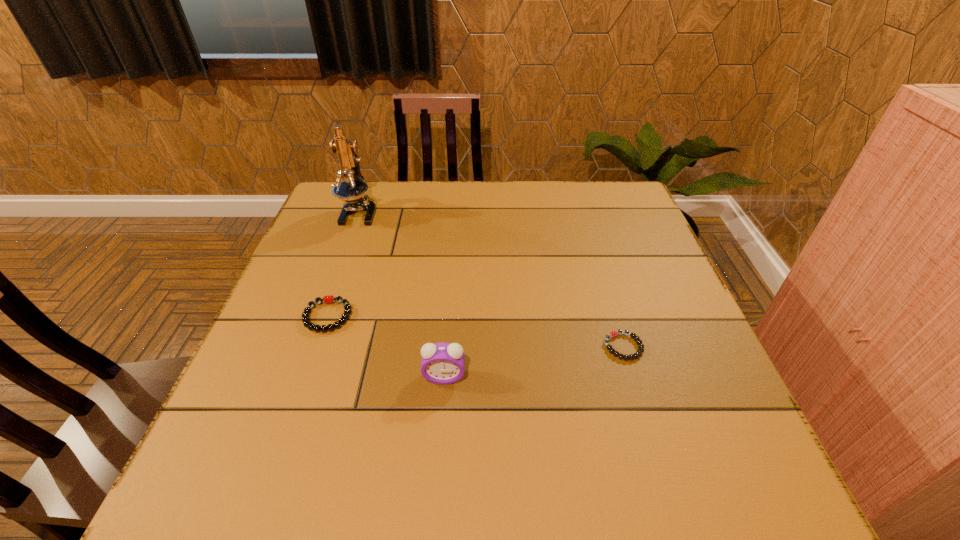
In order to click on empty location between the third tallest object and the shorter bracelet in this screenshot , I will do `click(475, 332)`.

I want to click on free space between the right bracelet and the nearest object, so click(534, 362).

Point out which object is positioned as the nearest to the third shortest object. Please provide its 2D coordinates. Your answer should be formatted as a tuple, i.e. [(x, y)], where the tuple contains the x and y coordinates of a point satisfying the conditions above.

[(328, 299)]

I want to click on object that stands as the second closest to the taller bracelet, so (353, 190).

Where is `vacant space that satisfies the following two spatial constraints: 1. at the eyepiece of the tallest object; 2. on the right side of the taller bracelet`? vacant space that satisfies the following two spatial constraints: 1. at the eyepiece of the tallest object; 2. on the right side of the taller bracelet is located at coordinates pyautogui.click(x=322, y=316).

Locate an element on the screen. This screenshot has width=960, height=540. free space that satisfies the following two spatial constraints: 1. at the eyepiece of the rightmost object; 2. on the right side of the farthest object is located at coordinates click(311, 347).

Identify the location of free location that satisfies the following two spatial constraints: 1. at the eyepiece of the farthest object; 2. on the right side of the right bracelet. This screenshot has width=960, height=540. (311, 347).

Locate an element on the screen. The width and height of the screenshot is (960, 540). vacant area that satisfies the following two spatial constraints: 1. at the eyepiece of the rightmost object; 2. on the left side of the tallest object is located at coordinates (311, 347).

Locate an element on the screen. Image resolution: width=960 pixels, height=540 pixels. vacant space that satisfies the following two spatial constraints: 1. at the eyepiece of the rightmost object; 2. on the right side of the farthest object is located at coordinates (311, 347).